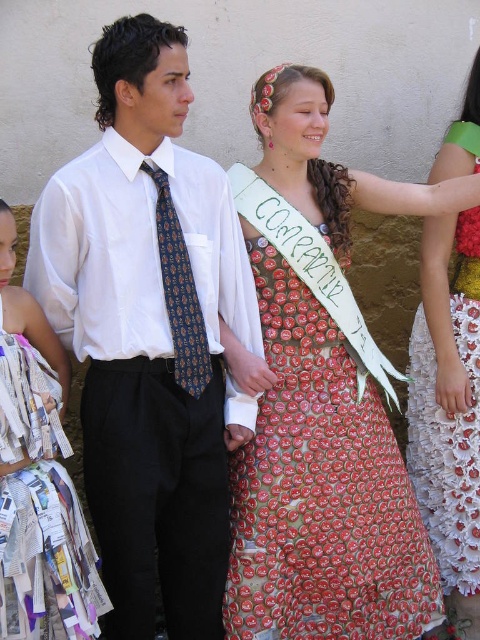
Who is shorter, matte white shirt at center or recycled paper dress at center?

recycled paper dress at center

Measure the distance between matte white shirt at center and camera.

They are 2.78 meters apart.

Find the location of a particular element. matte white shirt at center is located at coordinates (148, 332).

Which is below, recycled paper dress at center or dark blue silk tie at center?

recycled paper dress at center

Consider the image. Is recycled paper dress at center shorter than dark blue silk tie at center?

No, recycled paper dress at center is not shorter than dark blue silk tie at center.

Where is `recycled paper dress at center`? This screenshot has width=480, height=640. recycled paper dress at center is located at coordinates 38,477.

Is printed fabric dress at center below recycled paper dress at center?

No, printed fabric dress at center is not below recycled paper dress at center.

Find the location of a particular element. The width and height of the screenshot is (480, 640). printed fabric dress at center is located at coordinates (320, 456).

Where is `printed fabric dress at center`? printed fabric dress at center is located at coordinates [320, 456].

The height and width of the screenshot is (640, 480). I want to click on printed fabric dress at center, so click(x=320, y=456).